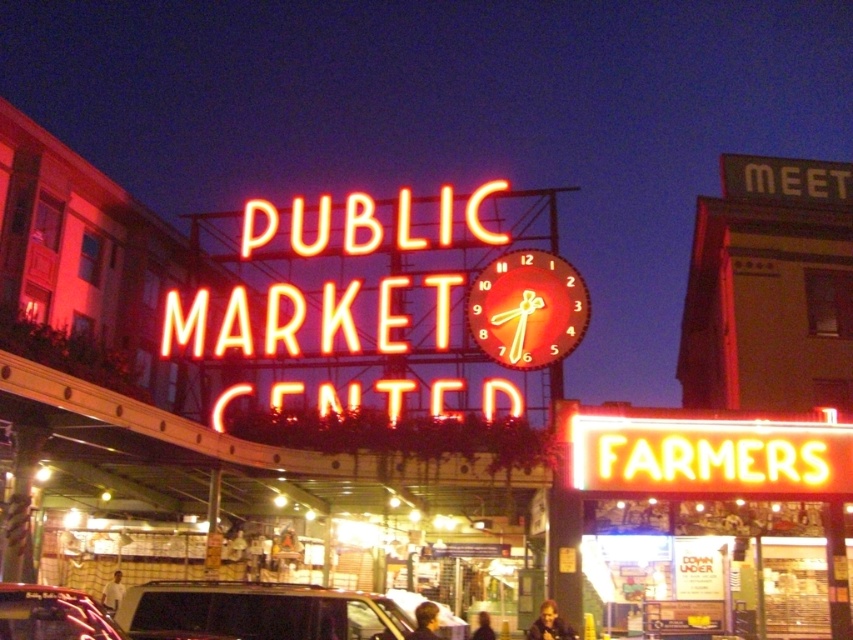
You are a customer entering the PUBLIC MARKET CENTER and notice two neon signs. The first is the neontexturedsign at center, and the second is the neon illuminated clock at center. Which of these two signs is positioned higher up in the scene?

The neontexturedsign at center is located above the neon illuminated clock at center, so it is positioned higher up in the scene.

You are standing at the entrance of the PUBLIC MARKET CENTER and see the dark gray metallic suv at center. Can you estimate its position relative to the main sign?

The dark gray metallic suv at center is located at point coordinates 0.955 in the x and 0.306 in the y, so it is positioned to the far right and slightly below the main sign.

You are driving a dark gray metallic suv at center and want to park it under the neontexturedsign at center. Can you fit the suv under the sign without touching it?

The neontexturedsign at center might be wider than dark gray metallic suv at center, so there is a possibility that the suv can fit under the sign without touching it, but the exact width difference is uncertain.